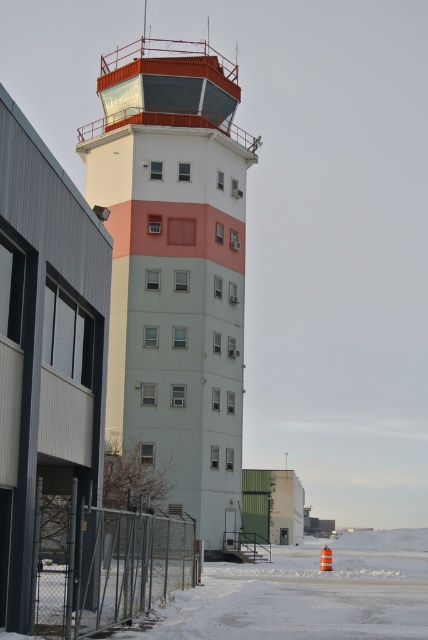
Based on the photo, is white painted concrete control tower at center shorter than metal chain-link fence at lower left?

Incorrect, white painted concrete control tower at center's height does not fall short of metal chain-link fence at lower left's.

Is point (196, 330) positioned in front of point (162, 579)?

No, (196, 330) is behind (162, 579).

Is point (228, 157) positioned behind point (127, 540)?

Yes, it is behind point (127, 540).

This screenshot has width=428, height=640. I want to click on white painted concrete control tower at center, so click(175, 266).